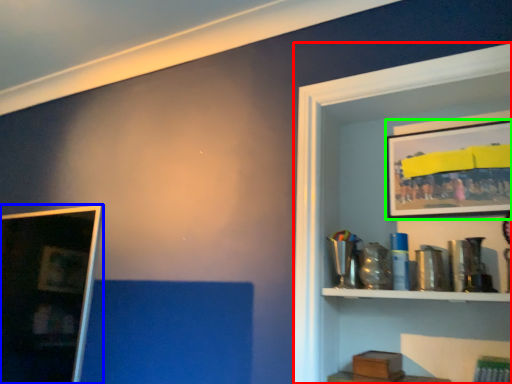
Question: Based on their relative distances, which object is farther from shelf (highlighted by a red box)? Choose from picture frame (highlighted by a blue box) and picture frame (highlighted by a green box).

Choices:
 (A) picture frame
 (B) picture frame

Answer: (A)